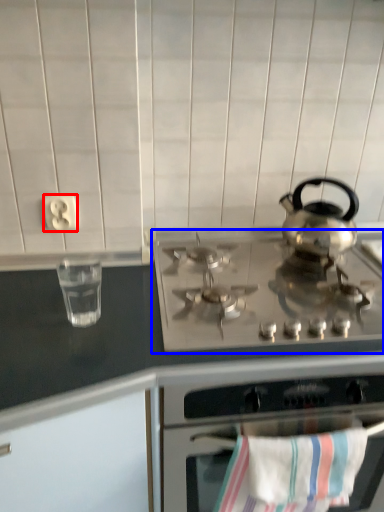
Question: Which object appears farthest to the camera in this image, electric outlet (highlighted by a red box) or gas stove (highlighted by a blue box)?

Choices:
 (A) electric outlet
 (B) gas stove

Answer: (A)